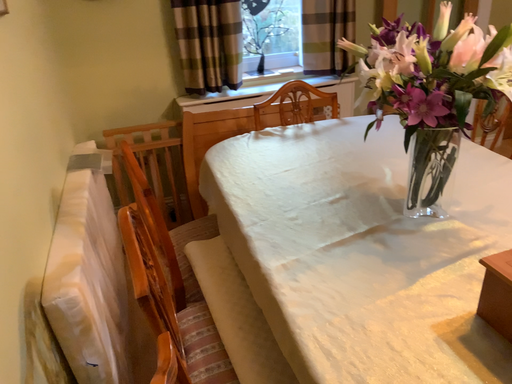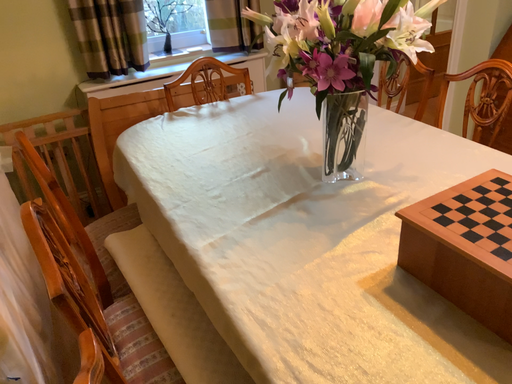
Question: Which way did the camera rotate in the video?

Choices:
 (A) rotated right
 (B) rotated left

Answer: (A)